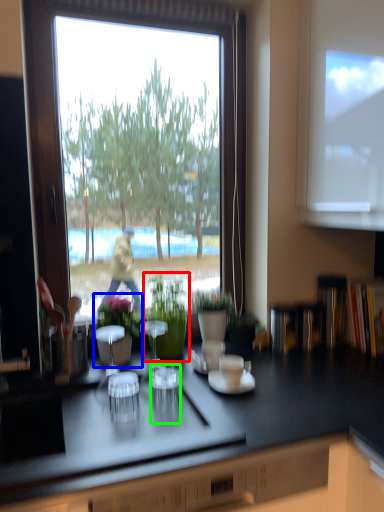
Question: Based on their relative distances, which object is nearer to houseplant (highlighted by a red box)? Choose from houseplant (highlighted by a blue box) and shot glass (highlighted by a green box).

Choices:
 (A) houseplant
 (B) shot glass

Answer: (A)